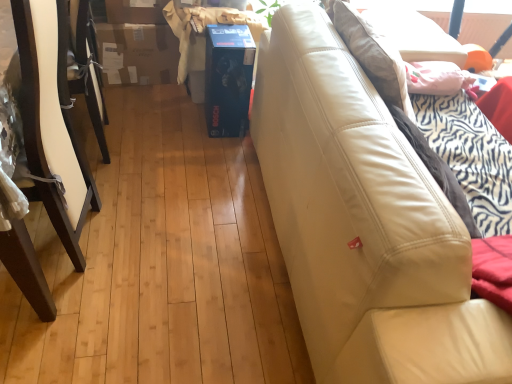
Locate an element on the screen. Image resolution: width=512 pixels, height=384 pixels. free region on the left part of beige leather couch at right is located at coordinates (187, 230).